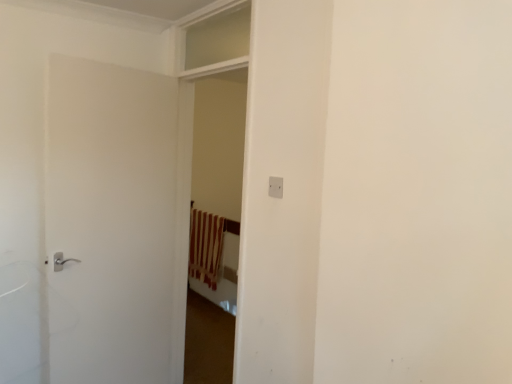
Question: Does white plastic electric outlet at center appear on the right side of white matte door at left?

Choices:
 (A) yes
 (B) no

Answer: (A)

Question: Can you confirm if white plastic electric outlet at center is shorter than white matte door at left?

Choices:
 (A) yes
 (B) no

Answer: (A)

Question: Is white plastic electric outlet at center smaller than white matte door at left?

Choices:
 (A) yes
 (B) no

Answer: (A)

Question: From the image's perspective, is white plastic electric outlet at center located above white matte door at left?

Choices:
 (A) yes
 (B) no

Answer: (A)

Question: Would you say white plastic electric outlet at center is a long distance from white matte door at left?

Choices:
 (A) no
 (B) yes

Answer: (B)

Question: Is white plastic electric outlet at center to the left of white matte door at left from the viewer's perspective?

Choices:
 (A) no
 (B) yes

Answer: (A)

Question: Is the position of white plastic electric outlet at center more distant than that of brown striped curtain at center?

Choices:
 (A) no
 (B) yes

Answer: (A)

Question: Is white plastic electric outlet at center next to brown striped curtain at center?

Choices:
 (A) yes
 (B) no

Answer: (B)

Question: Is white plastic electric outlet at center at the right side of brown striped curtain at center?

Choices:
 (A) yes
 (B) no

Answer: (A)

Question: Would you say brown striped curtain at center is part of white plastic electric outlet at center's contents?

Choices:
 (A) no
 (B) yes

Answer: (A)

Question: Can you confirm if white plastic electric outlet at center is shorter than brown striped curtain at center?

Choices:
 (A) yes
 (B) no

Answer: (A)

Question: Is white plastic electric outlet at center far away from brown striped curtain at center?

Choices:
 (A) yes
 (B) no

Answer: (A)

Question: From a real-world perspective, is white matte door at left below brown striped curtain at center?

Choices:
 (A) yes
 (B) no

Answer: (B)